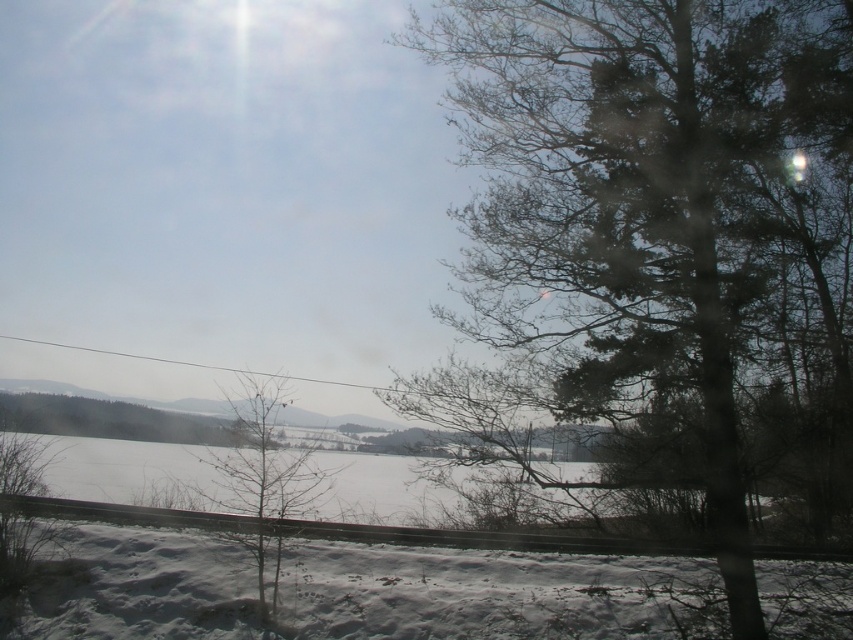
Question: Can you confirm if white fluffy snow at lower center is positioned above bare branches at center?

Choices:
 (A) yes
 (B) no

Answer: (B)

Question: Which is nearer to the dark green textured tree at right?

Choices:
 (A) white snow at center
 (B) bare branches at center
 (C) white fluffy snow at lower center

Answer: (C)

Question: Is white fluffy snow at lower center to the left of bare branches at center from the viewer's perspective?

Choices:
 (A) no
 (B) yes

Answer: (A)

Question: Does white snow at center have a lesser width compared to bare branches at center?

Choices:
 (A) no
 (B) yes

Answer: (A)

Question: Which point is farther from the camera taking this photo?

Choices:
 (A) (341, 467)
 (B) (252, 516)

Answer: (A)

Question: Which point is farther to the camera?

Choices:
 (A) white fluffy snow at lower center
 (B) white snow at center

Answer: (B)